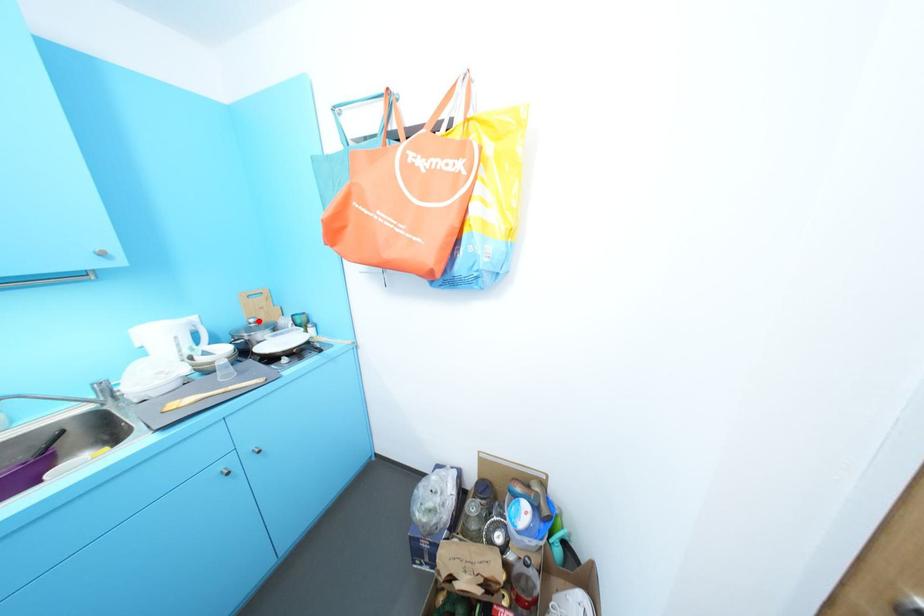
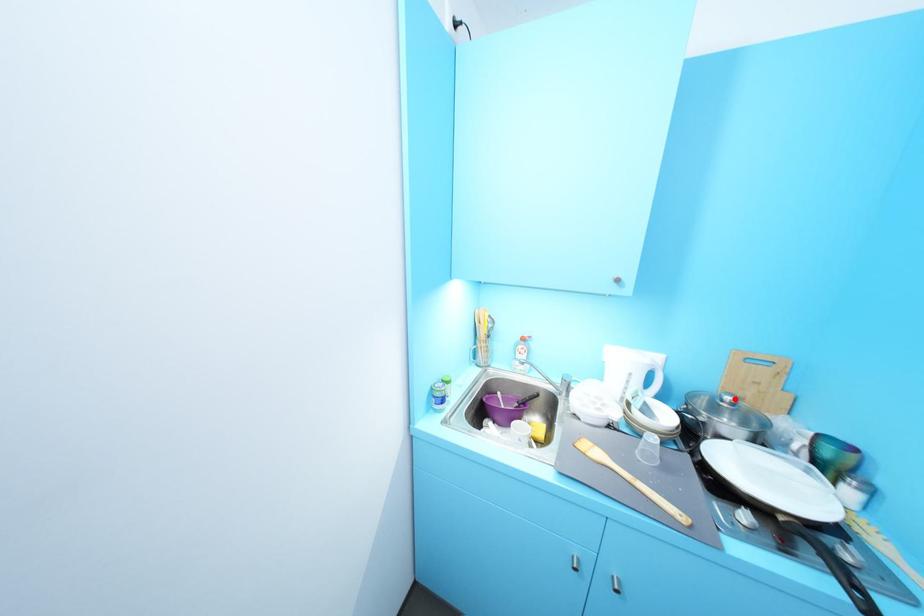
I am providing you with two images of the same scene from different viewpoints. A red point is marked on the first image and another point is marked on the second image. Is the red point in image1 aligned with the point shown in image2?

Yes